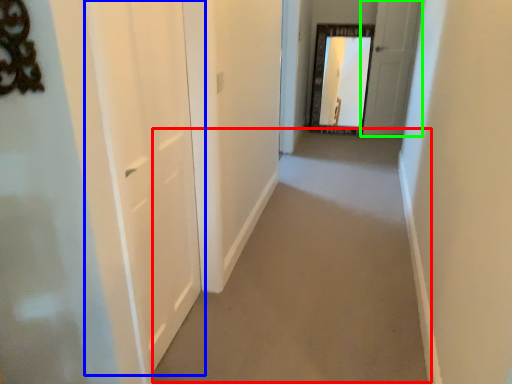
Question: Estimate the real-world distances between objects in this image. Which object is closer to path (highlighted by a red box), door (highlighted by a blue box) or door (highlighted by a green box)?

Choices:
 (A) door
 (B) door

Answer: (A)